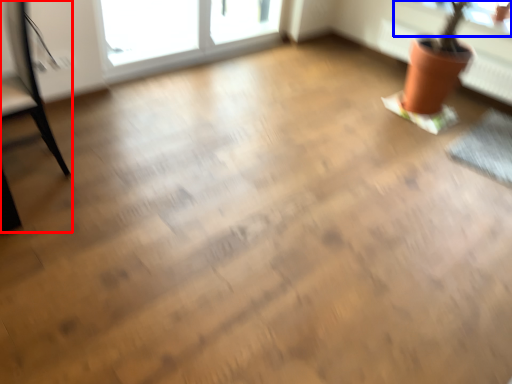
Question: Which point is further to the camera, armchair (highlighted by a red box) or window screen (highlighted by a blue box)?

Choices:
 (A) armchair
 (B) window screen

Answer: (B)